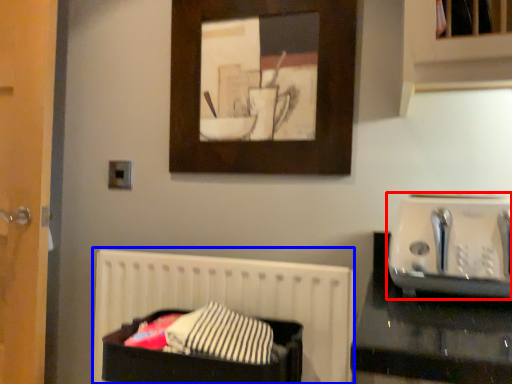
Question: Which of the following is the farthest to the observer, appliance (highlighted by a red box) or bed (highlighted by a blue box)?

Choices:
 (A) appliance
 (B) bed

Answer: (B)